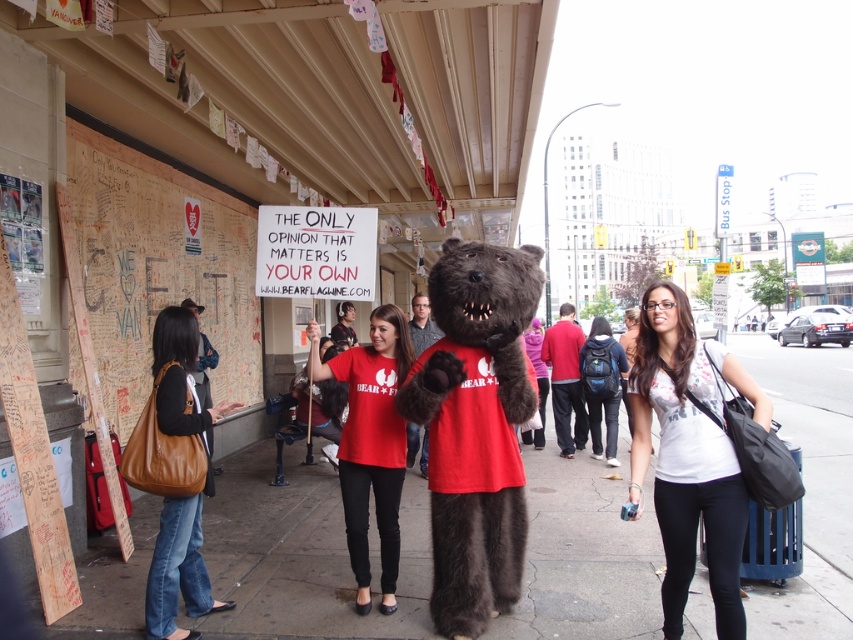
Is white matte tank top at center positioned before matte red t-shirt at center?

Yes, white matte tank top at center is in front of matte red t-shirt at center.

Between white matte tank top at center and matte red t-shirt at center, which one has less height?

With less height is matte red t-shirt at center.

Is point (683, 588) farther from viewer compared to point (364, 346)?

No, it is not.

You are a GUI agent. You are given a task and a screenshot of the screen. Output one action in this format:
    pyautogui.click(x=<x>, y=<y>)
    Task: Click on the white matte tank top at center
    This screenshot has width=853, height=640.
    Given the screenshot: What is the action you would take?
    pyautogui.click(x=689, y=454)

Consider the image. Does matte red t-shirt at center lie in front of brown leather purse at lower left?

No, it is behind brown leather purse at lower left.

Who is shorter, matte red t-shirt at center or brown leather purse at lower left?

With less height is brown leather purse at lower left.

What do you see at coordinates (370, 444) in the screenshot? This screenshot has width=853, height=640. I see `matte red t-shirt at center` at bounding box center [370, 444].

Image resolution: width=853 pixels, height=640 pixels. Find the location of `matte red t-shirt at center`. matte red t-shirt at center is located at coordinates (x=370, y=444).

Between concrete sidewalk at center and white matte tank top at center, which one is positioned higher?

white matte tank top at center is above.

The image size is (853, 640). I want to click on concrete sidewalk at center, so click(x=300, y=554).